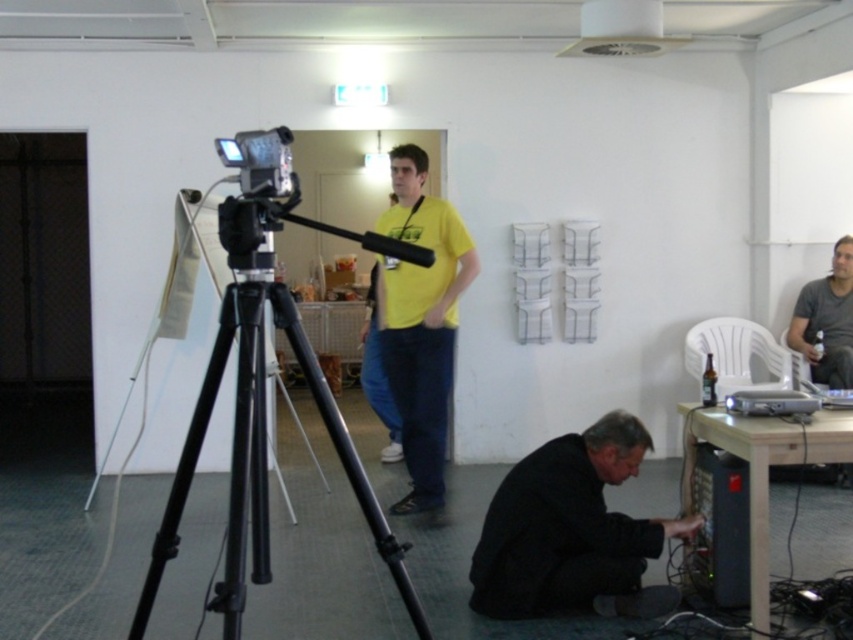
You are a photographer in the studio and need to adjust the lighting. You have a ladder that is 1.2 meters tall. The black matte jacket at lower center and the black plastic computer at lower right are in your way. Which object will the ladder reach over?

The ladder that is 1.2 meters tall will reach over both the black matte jacket at lower center and the black plastic computer at lower right since the jacket is taller than the computer.

You are a photographer in the studio and need to adjust the camera on the black metal tripod at center. To do this, you must first move the black matte jacket at lower center. Is the jacket currently blocking your access to the tripod?

The black metal tripod at center is positioned on the left side of black matte jacket at lower center, meaning the jacket is to the right of the tripod. Since the jacket is not directly in front of the tripod, it is likely not blocking access to it. You can adjust the camera without moving the jacket.

You are setting up equipment in a studio. You have a black metal tripod at center and a black plastic computer at lower right. Which object requires more space to accommodate its size?

The black metal tripod at center requires more space because it has a larger size compared to the black plastic computer at lower right.